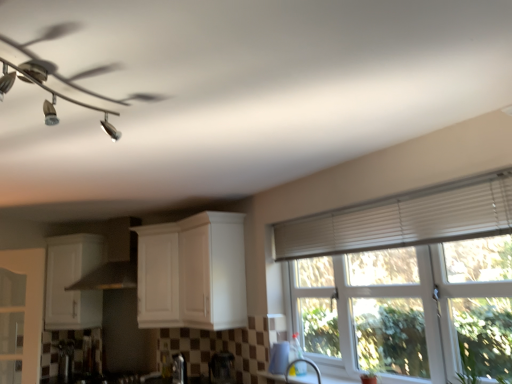
Question: From a real-world perspective, is satin nickel faucet at lower center on top of white glossy cup at lower center, the 1th appliance from the front?

Choices:
 (A) yes
 (B) no

Answer: (B)

Question: Does satin nickel faucet at lower center lie in front of white glossy cup at lower center, the 1th appliance from the front?

Choices:
 (A) no
 (B) yes

Answer: (B)

Question: Does satin nickel faucet at lower center have a smaller size compared to white glossy cup at lower center, the first appliance when ordered from right to left?

Choices:
 (A) no
 (B) yes

Answer: (A)

Question: Can you confirm if satin nickel faucet at lower center is taller than white glossy cup at lower center, the 1th appliance from the front?

Choices:
 (A) yes
 (B) no

Answer: (B)

Question: Can you confirm if satin nickel faucet at lower center is bigger than white glossy cup at lower center, the first appliance when ordered from right to left?

Choices:
 (A) no
 (B) yes

Answer: (B)

Question: From the image's perspective, is white textured window at upper right positioned above or below white matte cabinet at lower left, marked as the second cabinetry in a right-to-left arrangement?

Choices:
 (A) above
 (B) below

Answer: (A)

Question: Looking at their shapes, would you say white textured window at upper right is wider or thinner than white matte cabinet at lower left, marked as the second cabinetry in a right-to-left arrangement?

Choices:
 (A) thin
 (B) wide

Answer: (A)

Question: Is white textured window at upper right in front of or behind white matte cabinet at lower left, marked as the second cabinetry in a right-to-left arrangement, in the image?

Choices:
 (A) front
 (B) behind

Answer: (A)

Question: From a real-world perspective, is white textured window at upper right above or below white matte cabinet at lower left, marked as the second cabinetry in a right-to-left arrangement?

Choices:
 (A) above
 (B) below

Answer: (B)

Question: Is white textured blinds at upper right to the left or to the right of metallic silver ceiling fan at upper left in the image?

Choices:
 (A) left
 (B) right

Answer: (B)

Question: Considering the positions of white textured blinds at upper right and metallic silver ceiling fan at upper left in the image, is white textured blinds at upper right bigger or smaller than metallic silver ceiling fan at upper left?

Choices:
 (A) big
 (B) small

Answer: (A)

Question: Is white textured blinds at upper right in front of or behind metallic silver ceiling fan at upper left in the image?

Choices:
 (A) front
 (B) behind

Answer: (B)

Question: Considering the positions of white textured blinds at upper right and metallic silver ceiling fan at upper left in the image, is white textured blinds at upper right wider or thinner than metallic silver ceiling fan at upper left?

Choices:
 (A) wide
 (B) thin

Answer: (B)

Question: Is metallic silver kettle at lower center, the fourth appliance viewed from the left, taller or shorter than metallic silver ceiling fan at upper left?

Choices:
 (A) tall
 (B) short

Answer: (A)

Question: Considering the relative positions of metallic silver kettle at lower center, the 4th appliance positioned from the back, and metallic silver ceiling fan at upper left in the image provided, is metallic silver kettle at lower center, the 4th appliance positioned from the back, to the left or to the right of metallic silver ceiling fan at upper left?

Choices:
 (A) right
 (B) left

Answer: (A)